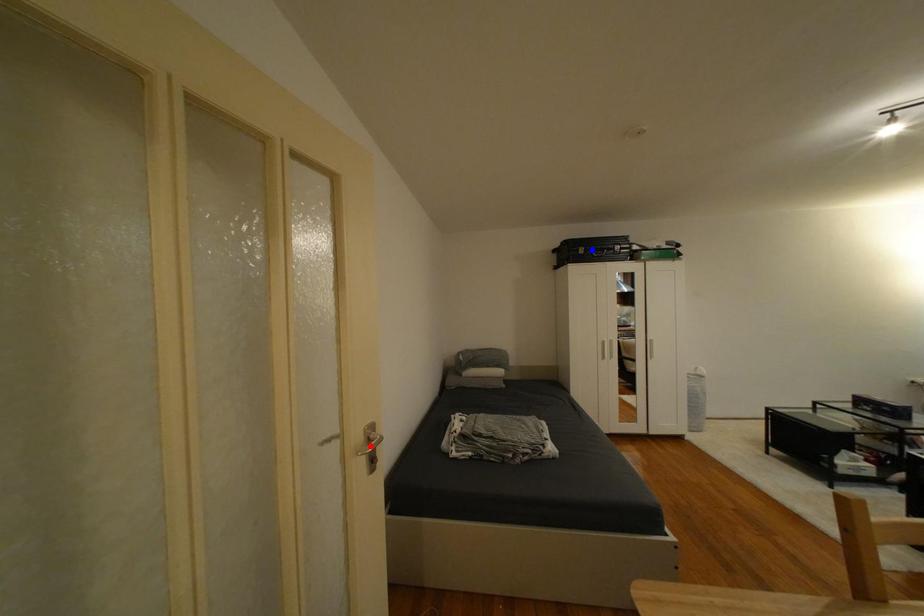
Question: In the image, two points are highlighted. Which point is nearer to the camera? Reply with the corresponding letter.

Choices:
 (A) blue point
 (B) red point

Answer: (B)